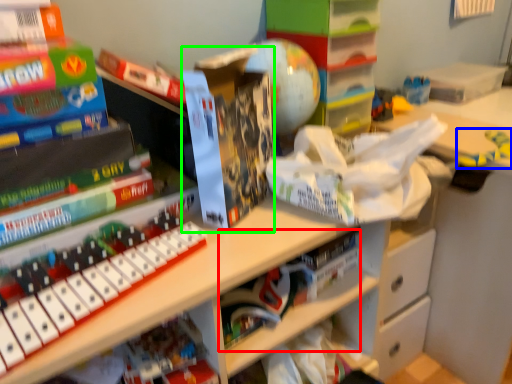
Question: Which object is positioned farthest from book (highlighted by a red box)? Select from toy (highlighted by a blue box) and paperback book (highlighted by a green box).

Choices:
 (A) toy
 (B) paperback book

Answer: (A)